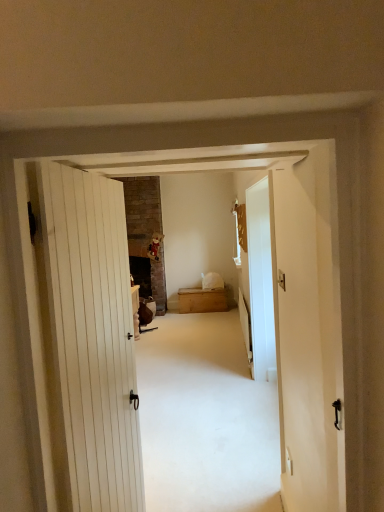
In order to face transparent glass door at right, should I rotate leftwards or rightwards?

Rotate right and turn 9.121 degrees.

The width and height of the screenshot is (384, 512). Describe the element at coordinates (261, 281) in the screenshot. I see `transparent glass door at right` at that location.

Where is `transparent glass door at right`? The height and width of the screenshot is (512, 384). transparent glass door at right is located at coordinates (261, 281).

Describe the element at coordinates (204, 296) in the screenshot. I see `wooden chest at center` at that location.

Where is `wooden chest at center`? This screenshot has width=384, height=512. wooden chest at center is located at coordinates click(204, 296).

At what (x,y) coordinates should I click in order to perform the action: click on transparent glass door at right. Please return your answer as a coordinate pair (x, y). Looking at the image, I should click on (261, 281).

Based on the photo, is wooden chest at center to the right of transparent glass door at right from the viewer's perspective?

No, wooden chest at center is not to the right of transparent glass door at right.

Who is more distant, wooden chest at center or transparent glass door at right?

wooden chest at center is further from the camera.

Is point (205, 302) closer to camera compared to point (251, 239)?

No, it is behind (251, 239).

From the image's perspective, which one is positioned lower, wooden chest at center or transparent glass door at right?

wooden chest at center, from the image's perspective.

Consider the image. From a real-world perspective, is wooden chest at center below transparent glass door at right?

Yes.

Does wooden chest at center have a lesser width compared to transparent glass door at right?

No, wooden chest at center is not thinner than transparent glass door at right.

Between wooden chest at center and transparent glass door at right, which one has more height?

transparent glass door at right is taller.

Based on their sizes in the image, would you say wooden chest at center is bigger or smaller than transparent glass door at right?

Clearly, wooden chest at center is larger in size than transparent glass door at right.

Is wooden chest at center spatially inside transparent glass door at right, or outside of it?

wooden chest at center is spatially situated outside transparent glass door at right.

Are wooden chest at center and transparent glass door at right located far from each other?

Yes, wooden chest at center is far from transparent glass door at right.

Is wooden chest at center oriented away from transparent glass door at right?

No.

The height and width of the screenshot is (512, 384). In the image, there is a wooden chest at center. Find the location of `glass door above it (from the image's perspective)`. glass door above it (from the image's perspective) is located at coordinates (261, 281).

Is transparent glass door at right to the left or to the right of wooden chest at center in the image?

From the image, it's evident that transparent glass door at right is to the right of wooden chest at center.

Based on the photo, who is more distant, transparent glass door at right or wooden chest at center?

wooden chest at center.

Is point (247, 222) farther from camera compared to point (208, 305)?

No.

From the image's perspective, is transparent glass door at right positioned above or below wooden chest at center?

From the image's perspective, transparent glass door at right appears above wooden chest at center.

From a real-world perspective, relative to wooden chest at center, is transparent glass door at right vertically above or below?

From a real-world perspective, transparent glass door at right is physically above wooden chest at center.

Is transparent glass door at right thinner than wooden chest at center?

Correct, the width of transparent glass door at right is less than that of wooden chest at center.

Considering the relative sizes of transparent glass door at right and wooden chest at center in the image provided, is transparent glass door at right taller than wooden chest at center?

Indeed, transparent glass door at right has a greater height compared to wooden chest at center.

Which of these two, transparent glass door at right or wooden chest at center, is smaller?

transparent glass door at right.

Is transparent glass door at right completely or partially outside of wooden chest at center?

Yes, transparent glass door at right is located beyond the bounds of wooden chest at center.

Does transparent glass door at right touch wooden chest at center?

No, transparent glass door at right is not in contact with wooden chest at center.

Looking at this image, could you tell me if transparent glass door at right is facing wooden chest at center?

No, transparent glass door at right is not aimed at wooden chest at center.

What's the angular difference between transparent glass door at right and wooden chest at center's facing directions?

The facing directions of transparent glass door at right and wooden chest at center are 92.7 degrees apart.

The width and height of the screenshot is (384, 512). I want to click on glass door positioned vertically above the wooden chest at center (from a real-world perspective), so click(261, 281).

Locate an element on the screen. bed behind the transparent glass door at right is located at coordinates (204, 296).

What are the coordinates of `bed below the transparent glass door at right (from the image's perspective)` in the screenshot? It's located at (204, 296).